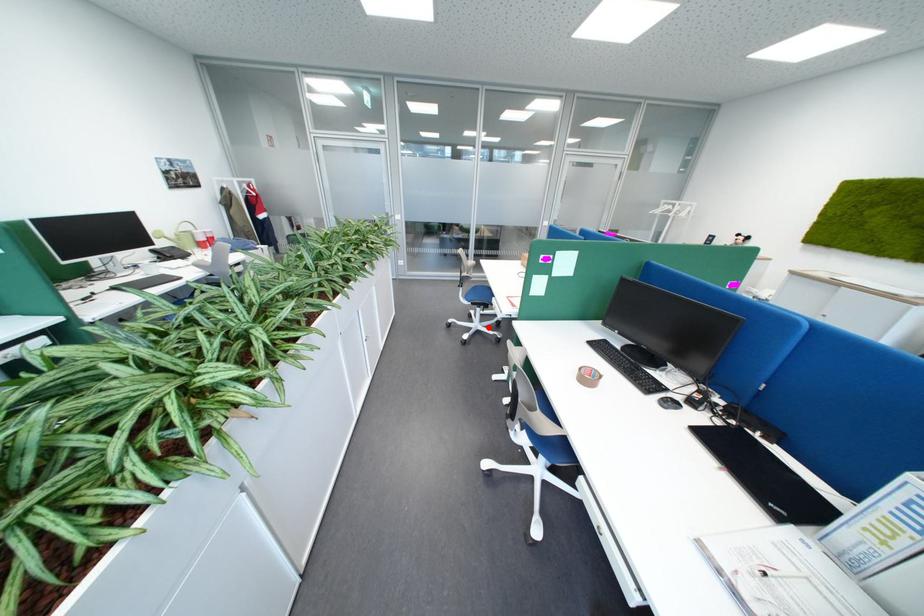
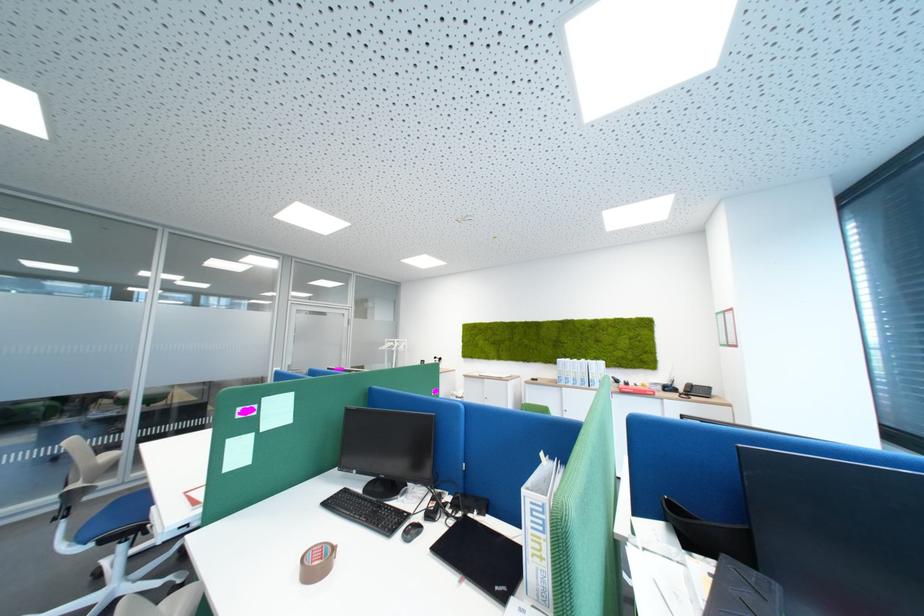
Question: I am providing you with two images of the same scene from different viewpoints. Image1 has a red point marked. In image2, the corresponding 3D location appears at what relative position? Reply with the corresponding letter.

Choices:
 (A) Closer
 (B) Farther

Answer: (A)